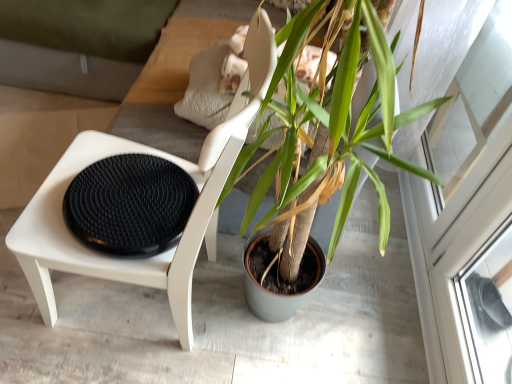
Question: Is white matte chair at left bigger or smaller than green matte plant pot at center?

Choices:
 (A) big
 (B) small

Answer: (A)

Question: Do you think white matte chair at left is within green matte plant pot at center, or outside of it?

Choices:
 (A) inside
 (B) outside

Answer: (B)

Question: Which is nearer to the transparent glass screen door at upper right?

Choices:
 (A) black textured footrest at left
 (B) white matte chair at left
 (C) green matte plant pot at center
 (D) green matte plant at center

Answer: (C)

Question: Based on their relative distances, which object is farther from the black textured footrest at left?

Choices:
 (A) white matte chair at left
 (B) green matte plant pot at center
 (C) transparent glass screen door at upper right
 (D) green matte plant at center

Answer: (C)